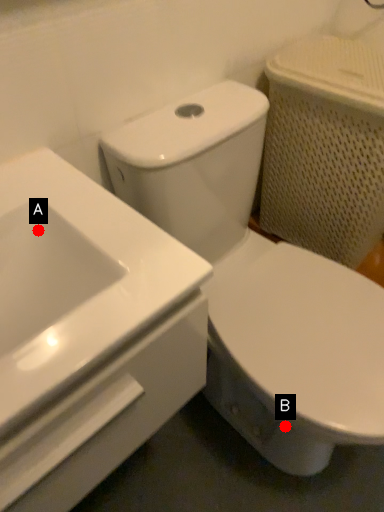
Question: Two points are circled on the image, labeled by A and B beside each circle. Among these points, which one is farthest from the camera?

Choices:
 (A) A is further
 (B) B is further

Answer: (B)